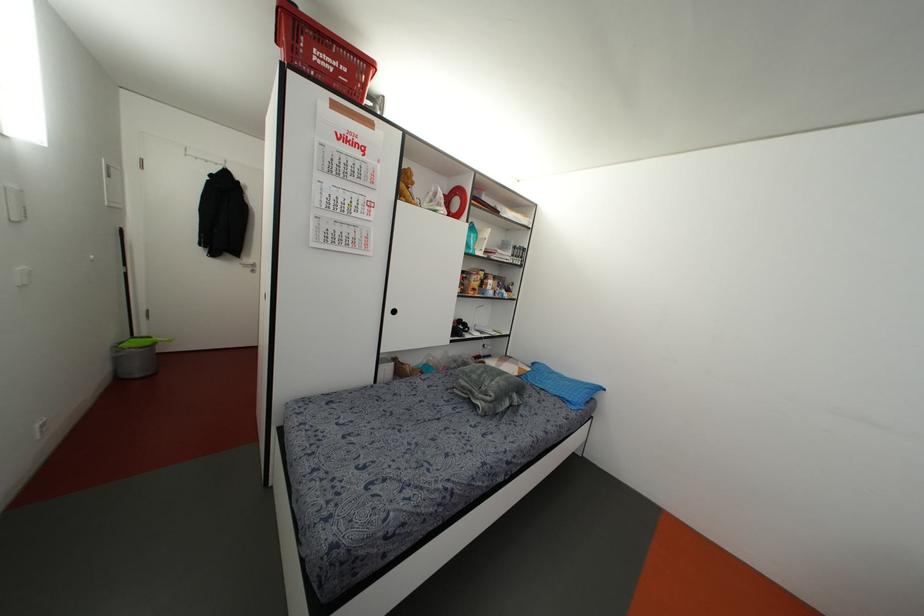
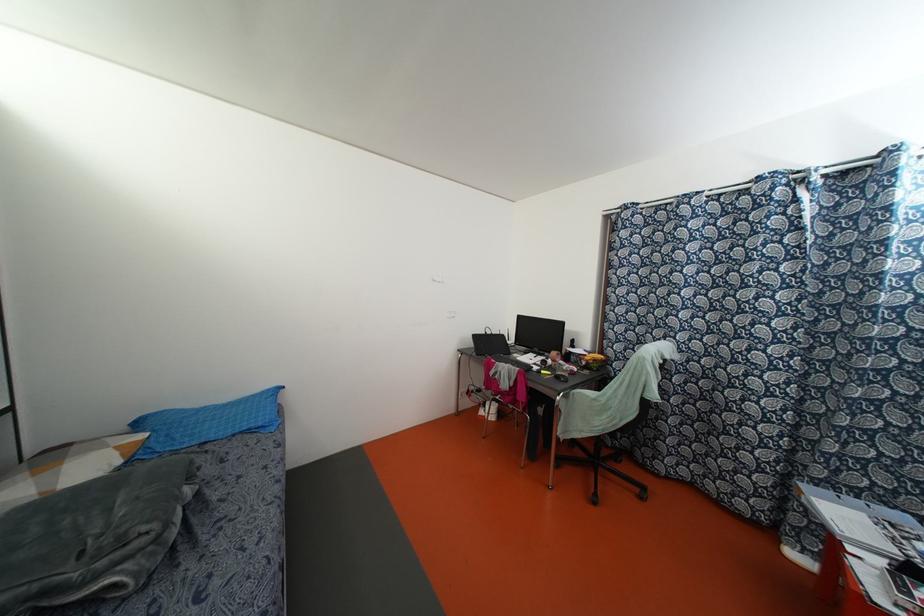
Find the pixel in the second image that matches point 569,399 in the first image.

(259, 424)